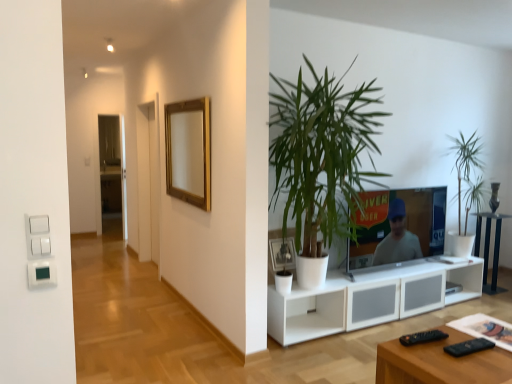
Where is `black plastic remote at lower right, which is the 2th remote in left-to-right order`? The height and width of the screenshot is (384, 512). black plastic remote at lower right, which is the 2th remote in left-to-right order is located at coordinates (468, 347).

The width and height of the screenshot is (512, 384). Identify the location of black glass side table at lower right. (488, 249).

Where is `white matte picture frame at center, marked as the first picture frame in a front-to-back arrangement`? The height and width of the screenshot is (384, 512). white matte picture frame at center, marked as the first picture frame in a front-to-back arrangement is located at coordinates (282, 254).

Where is `gold wooden picture frame at upper center, which appears as the second picture frame when viewed from the right`? The width and height of the screenshot is (512, 384). gold wooden picture frame at upper center, which appears as the second picture frame when viewed from the right is located at coordinates (189, 151).

The width and height of the screenshot is (512, 384). Describe the element at coordinates (422, 337) in the screenshot. I see `black plastic remote at lower right, which appears as the first remote when viewed from the left` at that location.

This screenshot has width=512, height=384. What are the coordinates of `green leafy plant at right, the 2th houseplant positioned from the front` in the screenshot? It's located at (465, 162).

Between point (179, 113) and point (118, 171), which one is positioned behind?

The point (118, 171) is farther from the camera.

Where is `glass door on the left of gold wooden picture frame at upper center, acting as the first picture frame starting from the top`? The width and height of the screenshot is (512, 384). glass door on the left of gold wooden picture frame at upper center, acting as the first picture frame starting from the top is located at coordinates (112, 169).

Looking at this image, looking at the image, does gold wooden picture frame at upper center, acting as the first picture frame starting from the top, seem bigger or smaller compared to transparent glass door at center?

gold wooden picture frame at upper center, acting as the first picture frame starting from the top, is smaller than transparent glass door at center.

Is gold wooden picture frame at upper center, acting as the first picture frame starting from the top, positioned with its back to transparent glass door at center?

No.

Is green leafy plant at center, which appears as the 2th houseplant when viewed from the right, inside the boundaries of black plastic remote at lower right, which is the 2th remote in left-to-right order, or outside?

green leafy plant at center, which appears as the 2th houseplant when viewed from the right, is not enclosed by black plastic remote at lower right, which is the 2th remote in left-to-right order.

Can you confirm if green leafy plant at center, the first houseplant viewed from the front, is bigger than black plastic remote at lower right, which is the first remote in right-to-left order?

Yes, green leafy plant at center, the first houseplant viewed from the front, is bigger than black plastic remote at lower right, which is the first remote in right-to-left order.

From a real-world perspective, does green leafy plant at center, which is counted as the 2th houseplant, starting from the back, stand above black plastic remote at lower right, which is the first remote in right-to-left order?

Yes, from a real-world perspective, green leafy plant at center, which is counted as the 2th houseplant, starting from the back, is above black plastic remote at lower right, which is the first remote in right-to-left order.

Considering the sizes of green leafy plant at center, the first houseplant viewed from the front, and black plastic remote at lower right, which is the first remote in right-to-left order, in the image, is green leafy plant at center, the first houseplant viewed from the front, wider or thinner than black plastic remote at lower right, which is the first remote in right-to-left order,?

Clearly, green leafy plant at center, the first houseplant viewed from the front, has more width compared to black plastic remote at lower right, which is the first remote in right-to-left order.

Based on the photo, can you tell me how much black plastic remote at lower right, the 2th remote from the right, and transparent glass door at center differ in facing direction?

172 degrees.

Is black plastic remote at lower right, the 2th remote from the right, smaller than transparent glass door at center?

Yes, black plastic remote at lower right, the 2th remote from the right, is smaller than transparent glass door at center.

Is black plastic remote at lower right, which appears as the first remote when viewed from the left, to the left of transparent glass door at center from the viewer's perspective?

No.

From a real-world perspective, between black plastic remote at lower right, the 2th remote from the right, and transparent glass door at center, who is vertically lower?

From a 3D spatial view, black plastic remote at lower right, the 2th remote from the right, is below.

Looking at their sizes, would you say gold wooden picture frame at upper center, which is the second picture frame in front-to-back order, is wider or thinner than black plastic remote at lower right, the 2th remote from the right?

In the image, gold wooden picture frame at upper center, which is the second picture frame in front-to-back order, appears to be wider than black plastic remote at lower right, the 2th remote from the right.

Between gold wooden picture frame at upper center, which appears as the second picture frame when viewed from the right, and black plastic remote at lower right, which appears as the first remote when viewed from the left, which one has more height?

Standing taller between the two is gold wooden picture frame at upper center, which appears as the second picture frame when viewed from the right.

Considering the relative positions of gold wooden picture frame at upper center, which appears as the second picture frame when viewed from the right, and black plastic remote at lower right, the 2th remote from the right, in the image provided, is gold wooden picture frame at upper center, which appears as the second picture frame when viewed from the right, to the left or to the right of black plastic remote at lower right, the 2th remote from the right,?

In the image, gold wooden picture frame at upper center, which appears as the second picture frame when viewed from the right, appears on the left side of black plastic remote at lower right, the 2th remote from the right.

Looking at this image, is white matte picture frame at center, acting as the 1th picture frame starting from the right, aimed at green leafy plant at center, the 1th houseplant from the left?

Yes, white matte picture frame at center, acting as the 1th picture frame starting from the right, is turned towards green leafy plant at center, the 1th houseplant from the left.

From their relative heights in the image, would you say white matte picture frame at center, the second picture frame when ordered from top to bottom, is taller or shorter than green leafy plant at center, the 1th houseplant from the left?

Considering their sizes, white matte picture frame at center, the second picture frame when ordered from top to bottom, has less height than green leafy plant at center, the 1th houseplant from the left.

Does point (281, 241) appear closer or farther from the camera than point (354, 231)?

Point (281, 241) appears to be closer to the viewer than point (354, 231).

Considering the sizes of objects white matte picture frame at center, which is the second picture frame from left to right, and green leafy plant at center, which is counted as the 2th houseplant, starting from the back, in the image provided, who is bigger, white matte picture frame at center, which is the second picture frame from left to right, or green leafy plant at center, which is counted as the 2th houseplant, starting from the back,?

Bigger between the two is green leafy plant at center, which is counted as the 2th houseplant, starting from the back.

Consider the image. Would you say white matte picture frame at center, acting as the 1th picture frame starting from the right, contains transparent glass door at center?

No, transparent glass door at center is not surrounded by white matte picture frame at center, acting as the 1th picture frame starting from the right.

Is there a large distance between white matte picture frame at center, the second picture frame when ordered from top to bottom, and transparent glass door at center?

Absolutely, white matte picture frame at center, the second picture frame when ordered from top to bottom, is distant from transparent glass door at center.

Does white matte picture frame at center, which is the second picture frame from left to right, have a greater height compared to transparent glass door at center?

Incorrect, the height of white matte picture frame at center, which is the second picture frame from left to right, is not larger of that of transparent glass door at center.

Is white matte picture frame at center, which is the 1th picture frame in bottom-to-top order, to the right of transparent glass door at center from the viewer's perspective?

Yes, white matte picture frame at center, which is the 1th picture frame in bottom-to-top order, is to the right of transparent glass door at center.

Can you confirm if gold wooden picture frame at upper center, which is counted as the first picture frame, starting from the left, is positioned to the left of green leafy plant at right, which appears as the 1th houseplant when viewed from the back?

Indeed, gold wooden picture frame at upper center, which is counted as the first picture frame, starting from the left, is positioned on the left side of green leafy plant at right, which appears as the 1th houseplant when viewed from the back.

Which of these two, gold wooden picture frame at upper center, which is counted as the first picture frame, starting from the left, or green leafy plant at right, the second houseplant from the left, is thinner?

gold wooden picture frame at upper center, which is counted as the first picture frame, starting from the left, is thinner.

From the image's perspective, is gold wooden picture frame at upper center, which appears as the second picture frame when viewed from the right, located beneath green leafy plant at right, which appears as the 1th houseplant when viewed from the back?

Actually, gold wooden picture frame at upper center, which appears as the second picture frame when viewed from the right, appears above green leafy plant at right, which appears as the 1th houseplant when viewed from the back, in the image.

Locate an element on the screen. picture frame that is above the green leafy plant at right, the 2th houseplant positioned from the front (from a real-world perspective) is located at coordinates (189, 151).

Identify the location of glass door lying on the left of gold wooden picture frame at upper center, which is the second picture frame in front-to-back order. The image size is (512, 384). (112, 169).

The image size is (512, 384). I want to click on the 1st houseplant behind the black plastic remote at lower right, which is the 2th remote in left-to-right order, so click(x=322, y=155).

When comparing their distances from white matte picture frame at center, which is the second picture frame from left to right, does black glass side table at lower right or gold wooden picture frame at upper center, which is the 2th picture frame from bottom to top, seem closer?

Based on the image, gold wooden picture frame at upper center, which is the 2th picture frame from bottom to top, appears to be nearer to white matte picture frame at center, which is the second picture frame from left to right.

Which object lies further to the anchor point matte black television at center, black plastic remote at lower right, which is the 2th remote in left-to-right order, or green leafy plant at center, which appears as the 2th houseplant when viewed from the right?

Based on the image, black plastic remote at lower right, which is the 2th remote in left-to-right order, appears to be further to matte black television at center.

Estimate the real-world distances between objects in this image. Which object is closer to matte black television at center, gold wooden picture frame at upper center, which is the second picture frame in front-to-back order, or transparent glass door at center?

gold wooden picture frame at upper center, which is the second picture frame in front-to-back order, lies closer to matte black television at center than the other object.

Based on the photo, based on their spatial positions, is white matte picture frame at center, which is the second picture frame from left to right, or matte black television at center further from black plastic remote at lower right, which appears as the first remote when viewed from the left?

Among the two, matte black television at center is located further to black plastic remote at lower right, which appears as the first remote when viewed from the left.

From the image, which object appears to be nearer to gold wooden picture frame at upper center, the first picture frame viewed from the back, green leafy plant at center, the 1th houseplant from the left, or green leafy plant at right, which appears as the 1th houseplant when viewed from the back?

green leafy plant at center, the 1th houseplant from the left, is closer to gold wooden picture frame at upper center, the first picture frame viewed from the back.

When comparing their distances from white matte picture frame at center, acting as the 1th picture frame starting from the right, does black plastic remote at lower right, the 2th remote from the right, or green leafy plant at right, the 2th houseplant positioned from the front, seem closer?

The object closer to white matte picture frame at center, acting as the 1th picture frame starting from the right, is black plastic remote at lower right, the 2th remote from the right.

Considering their positions, is green leafy plant at center, the first houseplant viewed from the front, positioned closer to green leafy plant at right, the second houseplant from the left, than white ceramic vase at center?

Based on the image, white ceramic vase at center appears to be nearer to green leafy plant at right, the second houseplant from the left.

Which object lies further to the anchor point green leafy plant at center, the 1th houseplant from the left, white ceramic vase at center or matte black television at center?

Based on the image, white ceramic vase at center appears to be further to green leafy plant at center, the 1th houseplant from the left.

Image resolution: width=512 pixels, height=384 pixels. In order to click on television located between transparent glass door at center and black glass side table at lower right in the left-right direction in this screenshot , I will do `click(406, 223)`.

Identify the location of remote positioned between black plastic remote at lower right, which is the 2th remote in left-to-right order, and white matte picture frame at center, marked as the first picture frame in a front-to-back arrangement, from near to far. (422, 337).

Where is `television between black plastic remote at lower right, which appears as the first remote when viewed from the left, and black glass side table at lower right, along the z-axis`? television between black plastic remote at lower right, which appears as the first remote when viewed from the left, and black glass side table at lower right, along the z-axis is located at coordinates (406, 223).

Locate an element on the screen. houseplant between black plastic remote at lower right, which appears as the first remote when viewed from the left, and white matte picture frame at center, the second picture frame when ordered from top to bottom, from front to back is located at coordinates (322, 155).